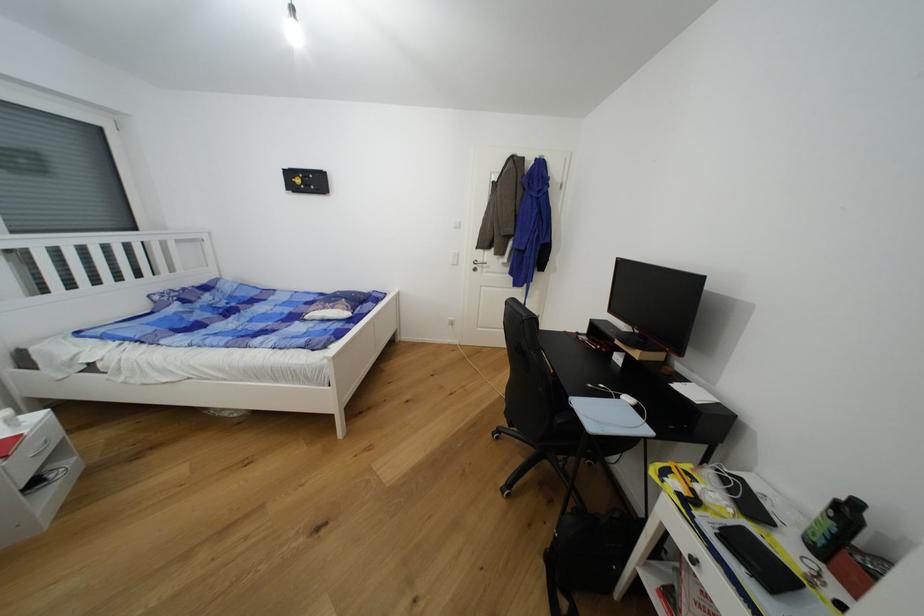
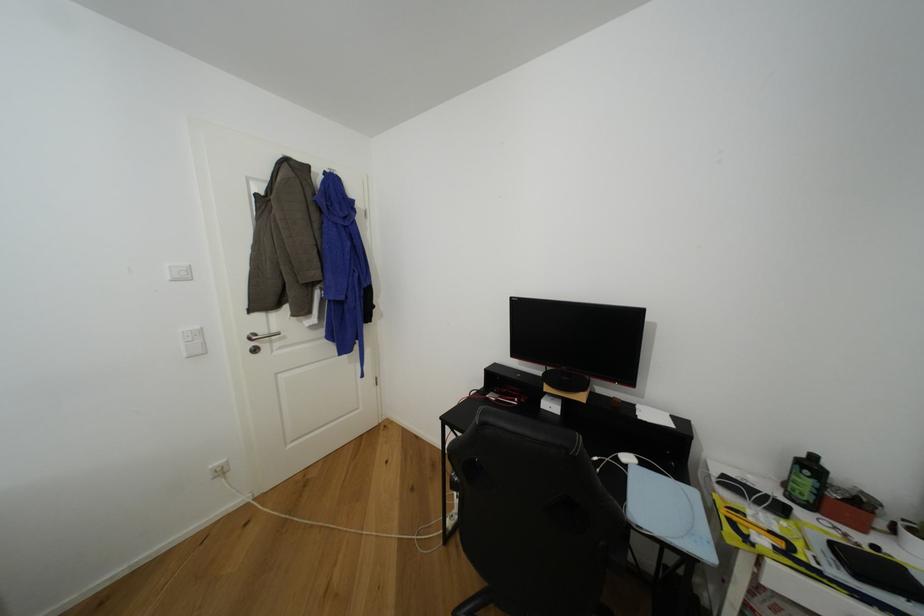
Where in the second image is the point corresponding to [612,323] from the first image?

(500, 366)